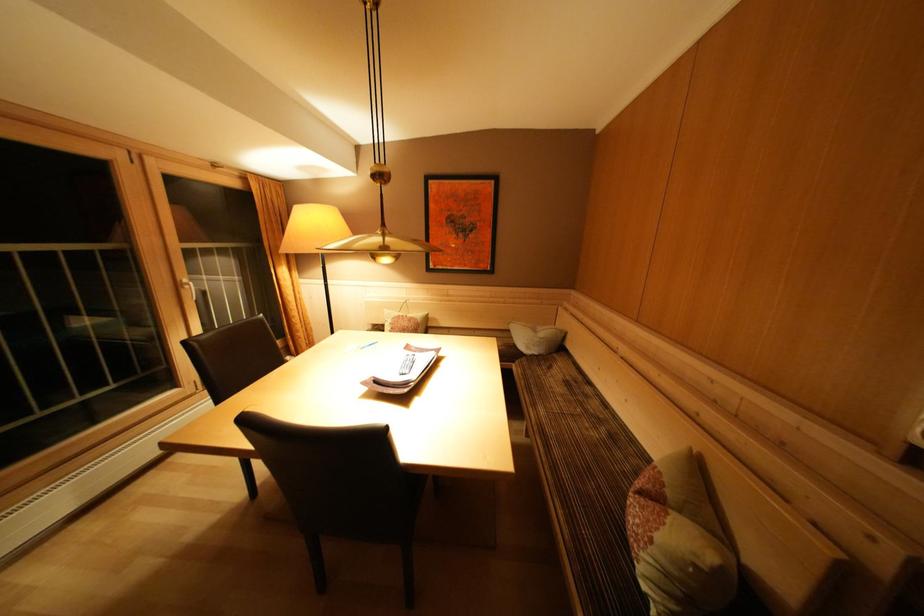
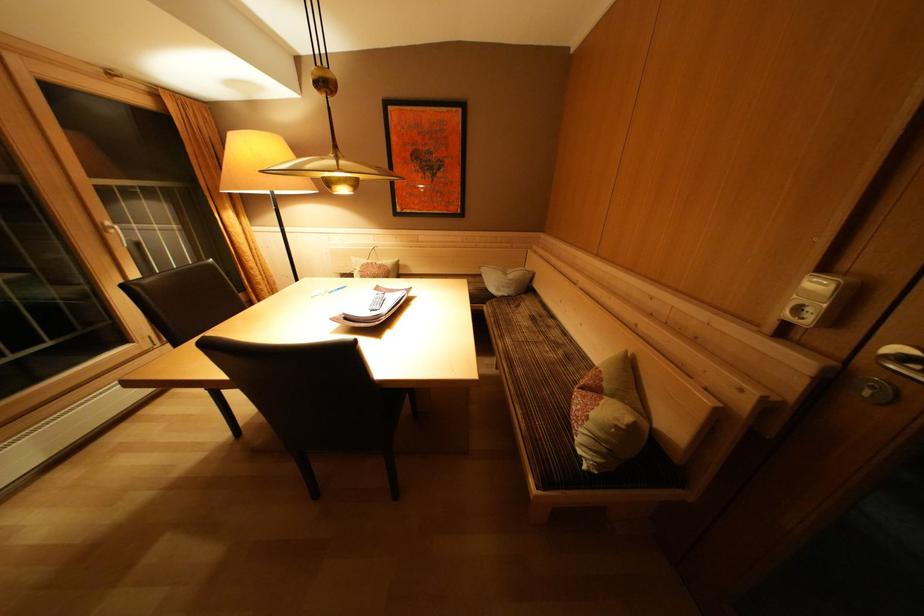
Where in the second image is the point corresponding to [192,286] from the first image?

(116, 229)